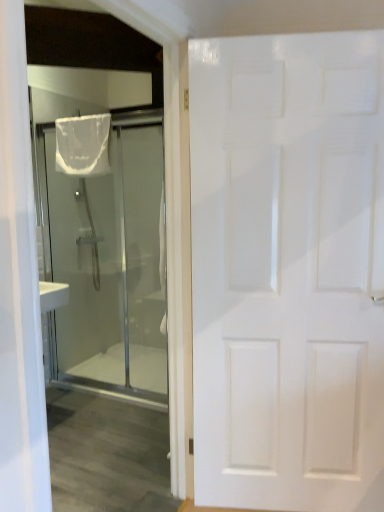
Question: Is white matte door at right, which is counted as the second door, starting from the back, with transparent glass shower at left, the 1th door in the back-to-front sequence?

Choices:
 (A) no
 (B) yes

Answer: (A)

Question: Considering the relative sizes of white matte door at right, which is the first door in right-to-left order, and transparent glass shower at left, the 2th door in the right-to-left sequence, in the image provided, is white matte door at right, which is the first door in right-to-left order, shorter than transparent glass shower at left, the 2th door in the right-to-left sequence,?

Choices:
 (A) yes
 (B) no

Answer: (B)

Question: Is white matte door at right, which is the first door in right-to-left order, taller than transparent glass shower at left, the 2th door in the right-to-left sequence?

Choices:
 (A) no
 (B) yes

Answer: (B)

Question: Is white matte door at right, which is the first door from front to back, oriented towards transparent glass shower at left, the 2th door in the right-to-left sequence?

Choices:
 (A) no
 (B) yes

Answer: (A)

Question: From a real-world perspective, does white matte door at right, which is counted as the second door, starting from the back, sit lower than transparent glass shower at left, the 2th door in the right-to-left sequence?

Choices:
 (A) yes
 (B) no

Answer: (B)

Question: Can you confirm if white matte door at right, which is the first door in right-to-left order, is bigger than transparent glass shower at left, the 1th door in the back-to-front sequence?

Choices:
 (A) no
 (B) yes

Answer: (B)

Question: Is transparent glass shower at left, the second door viewed from the front, behind white matte door at right, which is counted as the second door, starting from the back?

Choices:
 (A) no
 (B) yes

Answer: (B)

Question: From a real-world perspective, does transparent glass shower at left, the 2th door in the right-to-left sequence, sit lower than white matte door at right, which is the first door in right-to-left order?

Choices:
 (A) no
 (B) yes

Answer: (B)

Question: From a real-world perspective, is transparent glass shower at left, the 2th door in the right-to-left sequence, on top of white matte door at right, which is counted as the second door, starting from the back?

Choices:
 (A) yes
 (B) no

Answer: (B)

Question: From the image's perspective, is transparent glass shower at left, the second door viewed from the front, located beneath white matte door at right, which is the first door in right-to-left order?

Choices:
 (A) yes
 (B) no

Answer: (B)

Question: Considering the relative sizes of transparent glass shower at left, which ranks as the first door in left-to-right order, and white matte door at right, which is the first door from front to back, in the image provided, is transparent glass shower at left, which ranks as the first door in left-to-right order, wider than white matte door at right, which is the first door from front to back,?

Choices:
 (A) no
 (B) yes

Answer: (A)

Question: Does transparent glass shower at left, which ranks as the first door in left-to-right order, have a greater height compared to white matte door at right, which is the first door from front to back?

Choices:
 (A) no
 (B) yes

Answer: (A)

Question: From the image's perspective, would you say white sheer fabric at upper left is positioned over white matte door at right, which is the first door in right-to-left order?

Choices:
 (A) yes
 (B) no

Answer: (A)